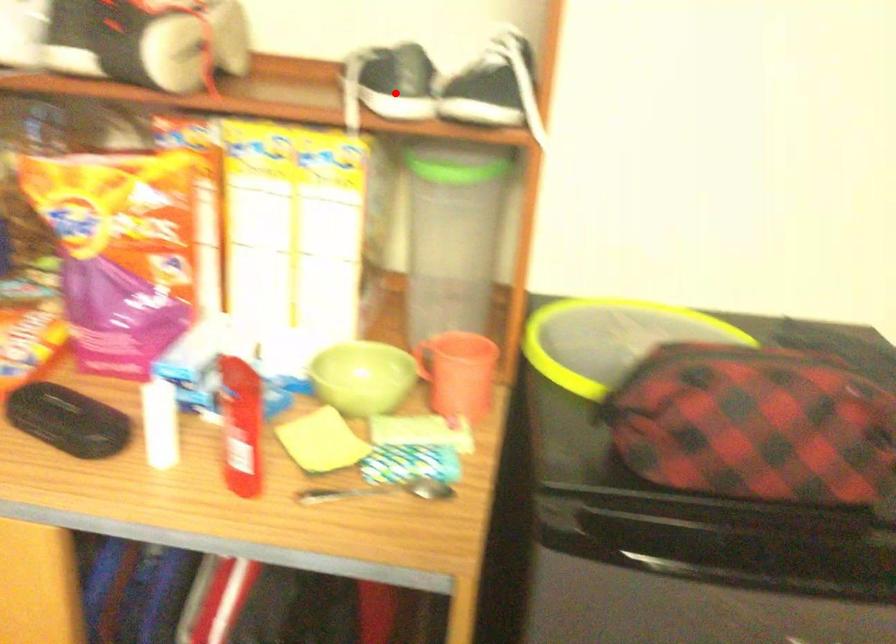
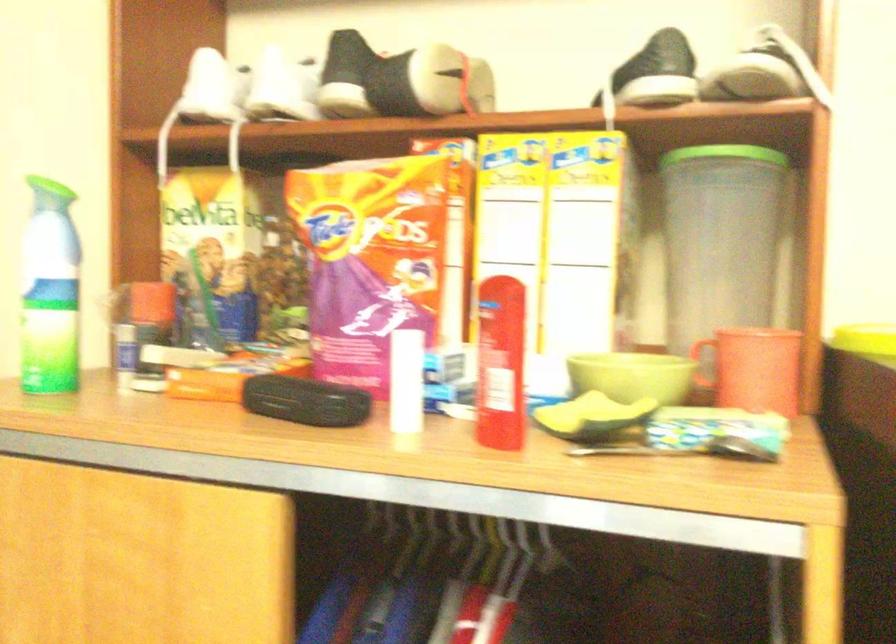
In the second image, find the point that corresponds to the highlighted location in the first image.

(656, 73)